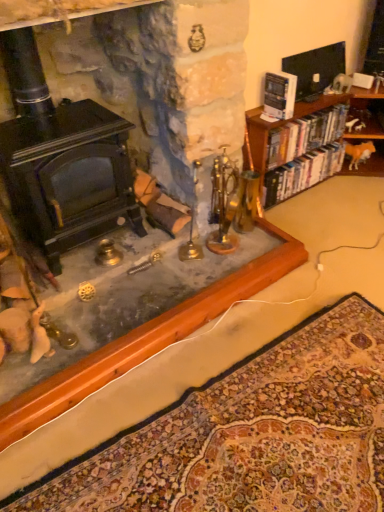
At what (x,y) coordinates should I click in order to perform the action: click on black matte fireplace at left. Please return your answer as a coordinate pair (x, y). Looking at the image, I should click on point(69,176).

Describe the element at coordinates (279, 95) in the screenshot. The width and height of the screenshot is (384, 512). I see `white paper book at upper right, the third book when ordered from back to front` at that location.

What do you see at coordinates (251, 434) in the screenshot?
I see `carpeted mat at lower center` at bounding box center [251, 434].

What is the approximate height of hardcover books at right, marked as the second book in a front-to-back arrangement?

The height of hardcover books at right, marked as the second book in a front-to-back arrangement, is 21.05 centimeters.

Identify the location of black matte fireplace at left. The image size is (384, 512). (x=69, y=176).

Is hardcover books at right, marked as the second book in a front-to-back arrangement, bigger than hardcover books at right, the first book when ordered from back to front?

Incorrect, hardcover books at right, marked as the second book in a front-to-back arrangement, is not larger than hardcover books at right, the first book when ordered from back to front.

From a real-world perspective, is hardcover books at right, marked as the second book in a front-to-back arrangement, located higher than hardcover books at right, which ranks as the 3th book in front-to-back order?

Yes.

Which object is thinner, hardcover books at right, marked as the second book in a front-to-back arrangement, or hardcover books at right, the first book when ordered from back to front?

With smaller width is hardcover books at right, marked as the second book in a front-to-back arrangement.

The height and width of the screenshot is (512, 384). I want to click on book that is the 1st object above the hardcover books at right, which ranks as the 3th book in front-to-back order (from a real-world perspective), so click(x=305, y=135).

Image resolution: width=384 pixels, height=512 pixels. Find the location of `fireplace on the left of the carpeted mat at lower center`. fireplace on the left of the carpeted mat at lower center is located at coordinates (69, 176).

In terms of width, does black matte fireplace at left look wider or thinner when compared to carpeted mat at lower center?

Clearly, black matte fireplace at left has less width compared to carpeted mat at lower center.

From the image's perspective, between black matte fireplace at left and carpeted mat at lower center, which one is located above?

black matte fireplace at left, from the image's perspective.

Could you tell me if hardcover books at right, which ranks as the 3th book in front-to-back order, is turned towards black matte fireplace at left?

No, hardcover books at right, which ranks as the 3th book in front-to-back order, is not aimed at black matte fireplace at left.

Is point (324, 156) positioned behind point (82, 108)?

Yes, it is behind point (82, 108).

In the image, is hardcover books at right, the first book when ordered from back to front, positioned in front of or behind black matte fireplace at left?

hardcover books at right, the first book when ordered from back to front, is positioned farther from the viewer than black matte fireplace at left.

Is black matte fireplace at left inside the boundaries of hardcover books at right, marked as the second book in a front-to-back arrangement, or outside?

The correct answer is: outside.

Does black matte fireplace at left turn towards hardcover books at right, the second book viewed from the back?

No, black matte fireplace at left is not oriented towards hardcover books at right, the second book viewed from the back.

From the image's perspective, is black matte fireplace at left positioned above or below hardcover books at right, the second book viewed from the back?

Clearly, from the image's perspective, black matte fireplace at left is below hardcover books at right, the second book viewed from the back.

Locate an element on the screen. The height and width of the screenshot is (512, 384). mat below the white paper book at upper right, the third book when ordered from back to front (from the image's perspective) is located at coordinates point(251,434).

Is the surface of carpeted mat at lower center in direct contact with white paper book at upper right, which is the first book from front to back?

No, carpeted mat at lower center is not in contact with white paper book at upper right, which is the first book from front to back.

Is point (342, 342) more distant than point (264, 106)?

No, (342, 342) is in front of (264, 106).

How much distance is there between carpeted mat at lower center and white paper book at upper right, the third book when ordered from back to front?

They are 1.39 meters apart.

From the image's perspective, which is below, white paper book at upper right, which is the first book from front to back, or black matte fireplace at left?

black matte fireplace at left.

How much distance is there between white paper book at upper right, the third book when ordered from back to front, and black matte fireplace at left?

white paper book at upper right, the third book when ordered from back to front, is 38.65 inches away from black matte fireplace at left.

Can you tell me how much white paper book at upper right, which is the first book from front to back, and black matte fireplace at left differ in facing direction?

2.3 degrees.

From a real-world perspective, who is located higher, white paper book at upper right, the third book when ordered from back to front, or black matte fireplace at left?

From a 3D spatial view, white paper book at upper right, the third book when ordered from back to front, is above.

In the image, is carpeted mat at lower center on the left side or the right side of hardcover books at right, which ranks as the 3th book in front-to-back order?

From the image, it's evident that carpeted mat at lower center is to the left of hardcover books at right, which ranks as the 3th book in front-to-back order.

Does carpeted mat at lower center have a greater height compared to hardcover books at right, the first book when ordered from back to front?

No, carpeted mat at lower center is not taller than hardcover books at right, the first book when ordered from back to front.

Is carpeted mat at lower center turned away from hardcover books at right, which ranks as the 3th book in front-to-back order?

carpeted mat at lower center does not have its back to hardcover books at right, which ranks as the 3th book in front-to-back order.

Image resolution: width=384 pixels, height=512 pixels. Identify the location of book that is the 1st object located above the hardcover books at right, which ranks as the 3th book in front-to-back order (from the image's perspective). (305, 135).

Locate an element on the screen. This screenshot has width=384, height=512. mat located in front of the black matte fireplace at left is located at coordinates (251, 434).

From the image, which object appears to be nearer to white paper book at upper right, which is the first book from front to back, hardcover books at right, the first book when ordered from back to front, or carpeted mat at lower center?

Among the two, hardcover books at right, the first book when ordered from back to front, is located nearer to white paper book at upper right, which is the first book from front to back.

Based on their spatial positions, is white paper book at upper right, which is the first book from front to back, or black matte fireplace at left further from carpeted mat at lower center?

white paper book at upper right, which is the first book from front to back.

In the scene shown: Looking at the image, which one is located further to hardcover books at right, the first book when ordered from back to front, hardcover books at right, marked as the second book in a front-to-back arrangement, or white paper book at upper right, the third book when ordered from back to front?

white paper book at upper right, the third book when ordered from back to front.

From the image, which object appears to be nearer to black matte fireplace at left, carpeted mat at lower center or hardcover books at right, marked as the second book in a front-to-back arrangement?

Among the two, carpeted mat at lower center is located nearer to black matte fireplace at left.

Looking at the image, which one is located further to carpeted mat at lower center, hardcover books at right, the first book when ordered from back to front, or black matte fireplace at left?

hardcover books at right, the first book when ordered from back to front, is positioned further to the anchor carpeted mat at lower center.

Estimate the real-world distances between objects in this image. Which object is further from hardcover books at right, which ranks as the 3th book in front-to-back order, black matte fireplace at left or carpeted mat at lower center?

carpeted mat at lower center is further to hardcover books at right, which ranks as the 3th book in front-to-back order.

Based on their spatial positions, is hardcover books at right, the first book when ordered from back to front, or carpeted mat at lower center further from hardcover books at right, the second book viewed from the back?

The object further to hardcover books at right, the second book viewed from the back, is carpeted mat at lower center.

Looking at this image, estimate the real-world distances between objects in this image. Which object is further from hardcover books at right, marked as the second book in a front-to-back arrangement, hardcover books at right, which ranks as the 3th book in front-to-back order, or black matte fireplace at left?

black matte fireplace at left.

You are a GUI agent. You are given a task and a screenshot of the screen. Output one action in this format:
    pyautogui.click(x=<x>, y=<y>)
    Task: Click on the fireplace that lies between hardcover books at right, the second book viewed from the back, and carpeted mat at lower center from top to bottom
    The width and height of the screenshot is (384, 512).
    Given the screenshot: What is the action you would take?
    pyautogui.click(x=69, y=176)

Locate an element on the screen. book situated between black matte fireplace at left and hardcover books at right, the second book viewed from the back, from left to right is located at coordinates (279, 95).

In order to click on fireplace between carpeted mat at lower center and hardcover books at right, which ranks as the 3th book in front-to-back order, along the z-axis in this screenshot , I will do [x=69, y=176].

Where is `book that lies between white paper book at upper right, which is the first book from front to back, and hardcover books at right, the first book when ordered from back to front, from top to bottom`? book that lies between white paper book at upper right, which is the first book from front to back, and hardcover books at right, the first book when ordered from back to front, from top to bottom is located at coordinates (305, 135).